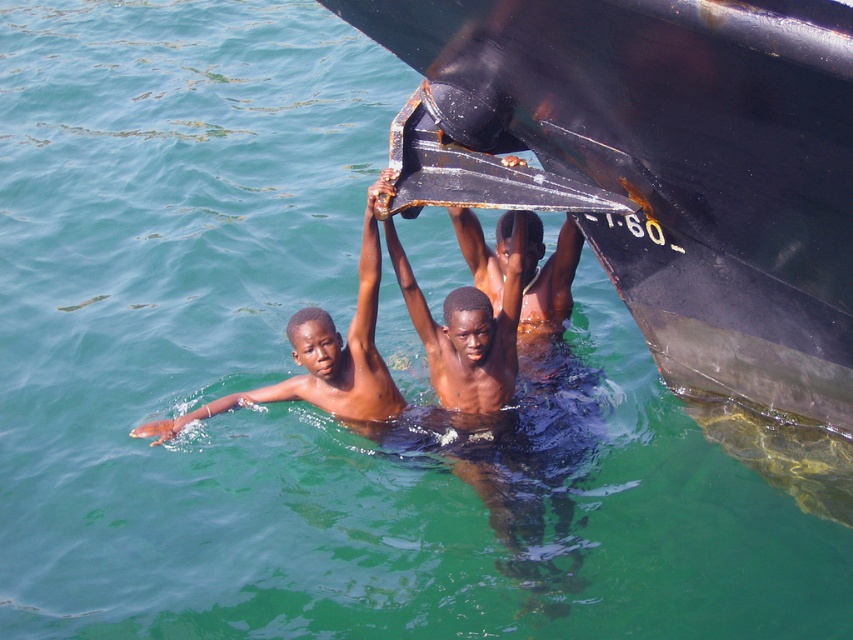
Question: Which point is farther to the camera?

Choices:
 (A) (717, 106)
 (B) (370, 284)
 (C) (453, 337)

Answer: (B)

Question: Which object appears closest to the camera in this image?

Choices:
 (A) smooth dark wood plank at center
 (B) smooth skin child at left
 (C) rusty metal boat at upper center

Answer: (C)

Question: Does rusty metal boat at upper center appear on the left side of smooth dark wood plank at center?

Choices:
 (A) yes
 (B) no

Answer: (B)

Question: Is rusty metal boat at upper center above smooth skin child at left?

Choices:
 (A) yes
 (B) no

Answer: (A)

Question: Does smooth skin child at left come behind smooth dark wood plank at center?

Choices:
 (A) yes
 (B) no

Answer: (B)

Question: Estimate the real-world distances between objects in this image. Which object is closer to the smooth skin child at left?

Choices:
 (A) smooth dark wood plank at center
 (B) rusty metal boat at upper center

Answer: (A)